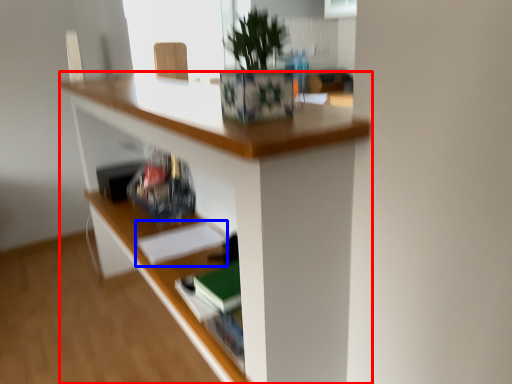
Question: Which object is further to the camera taking this photo, desk (highlighted by a red box) or paperback book (highlighted by a blue box)?

Choices:
 (A) desk
 (B) paperback book

Answer: (B)